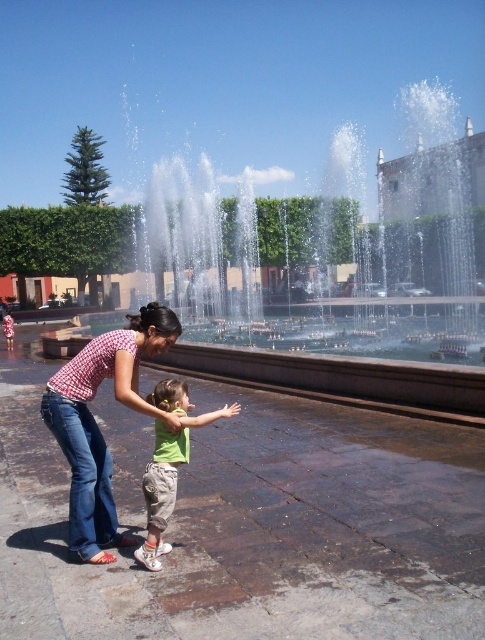
You are standing at the fountain in the plaza and want to take a photo of both the point at coordinates (366, 349) and the point at (83, 429). Which point should you focus on first to ensure both are in focus?

You should focus on the point at coordinates (366, 349) first because it is further away from you than the point at (83, 429). By focusing on the further point, both points will be in focus due to the depth of field.

You are standing in the plaza and want to take a photo of the clear water jets at center and the denim jeans at center. Which object should you focus on first if you want to capture both in one shot without moving the camera?

You should focus on the clear water jets at center first because it is closer to you than the denim jeans at center, allowing both to be in focus when using a shallow depth of field.

You are standing at the fountain in the plaza and want to place a small decorative stone between the two points, point (136,365) and point (155,529). Which point should you place it closer to if you want the stone to be closer to the viewer?

You should place the stone closer to point (136,365) because it is closer to the viewer than point (155,529).